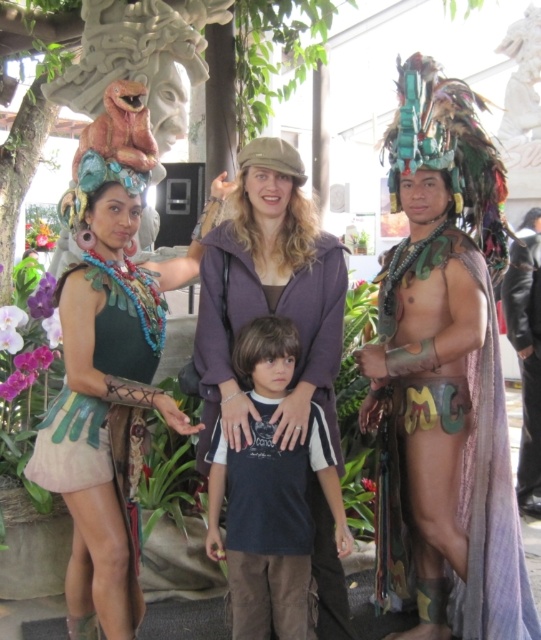
You are standing in front of the group of four individuals at the tropical event. There are two points marked in the image, one at coordinate point [464,483] and the other at point [123,324]. Which point is closer to your viewpoint?

Point [123,324] is closer to your viewpoint because it is less further away than point [464,483].

You are a photographer at the event and need to adjust the camera angle to capture both the multicolored feather headdress at center and the matte green fabric dress at left in the frame. Considering their heights, which object should you focus on first to ensure both are visible?

The multicolored feather headdress at center is taller than the matte green fabric dress at left, so you should focus on the multicolored feather headdress at center first to ensure both are visible in the frame.

You are a photographer trying to capture the perfect shot of the multicolored feather headdress at center. The camera you are using has a focus point at coordinates 0.577, 0.828. Will the headdress be in focus?

Yes, the multicolored feather headdress at center is exactly at the focus point (x=447, y=369), so it will be in focus.